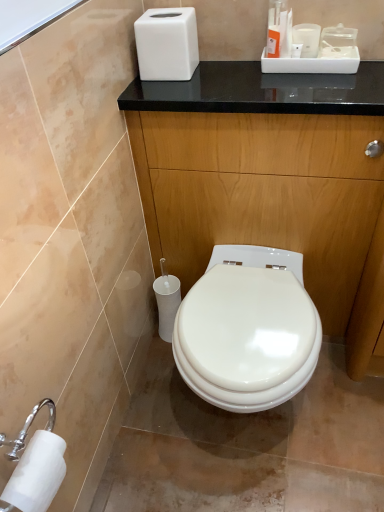
Question: Would you consider glossy wood dresser at center to be distant from white matte tissue box at upper center?

Choices:
 (A) no
 (B) yes

Answer: (A)

Question: Is glossy wood dresser at center at the left side of white matte tissue box at upper center?

Choices:
 (A) no
 (B) yes

Answer: (A)

Question: Can you confirm if glossy wood dresser at center is wider than white matte tissue box at upper center?

Choices:
 (A) yes
 (B) no

Answer: (A)

Question: From a real-world perspective, is glossy wood dresser at center on white matte tissue box at upper center?

Choices:
 (A) no
 (B) yes

Answer: (A)

Question: Is the position of glossy wood dresser at center less distant than that of white matte tissue box at upper center?

Choices:
 (A) no
 (B) yes

Answer: (B)

Question: Are glossy wood dresser at center and white matte tissue box at upper center beside each other?

Choices:
 (A) no
 (B) yes

Answer: (A)

Question: Considering the relative sizes of white matte tissue box at upper center and glossy wood dresser at center in the image provided, is white matte tissue box at upper center taller than glossy wood dresser at center?

Choices:
 (A) yes
 (B) no

Answer: (B)

Question: Does white matte tissue box at upper center come behind glossy wood dresser at center?

Choices:
 (A) yes
 (B) no

Answer: (A)

Question: Is white matte tissue box at upper center aimed at glossy wood dresser at center?

Choices:
 (A) no
 (B) yes

Answer: (A)

Question: Is white matte tissue box at upper center outside glossy wood dresser at center?

Choices:
 (A) yes
 (B) no

Answer: (A)

Question: Does white matte tissue box at upper center have a larger size compared to glossy wood dresser at center?

Choices:
 (A) yes
 (B) no

Answer: (B)

Question: Does white matte tissue box at upper center appear on the right side of glossy wood dresser at center?

Choices:
 (A) yes
 (B) no

Answer: (B)

Question: Does white matte toilet paper at lower left, arranged as the first toilet paper when viewed from the left, have a lesser height compared to white matte tissue box at upper center?

Choices:
 (A) no
 (B) yes

Answer: (B)